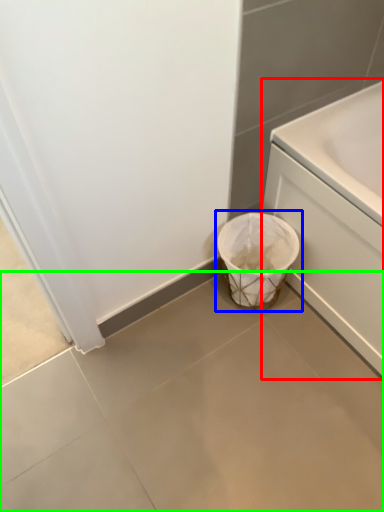
Question: Estimate the real-world distances between objects in this image. Which object is farther from bath (highlighted by a red box), waste container (highlighted by a blue box) or concrete (highlighted by a green box)?

Choices:
 (A) waste container
 (B) concrete

Answer: (B)